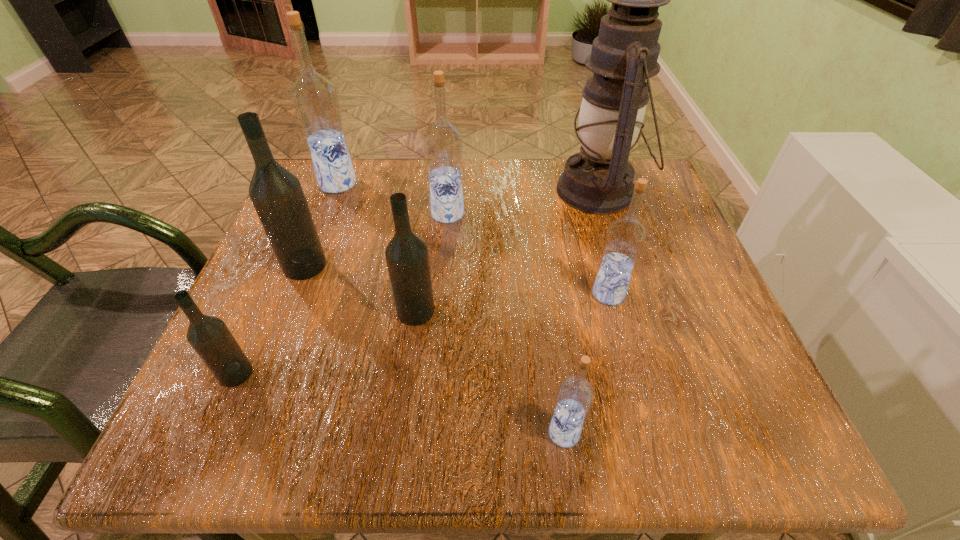
Find the location of a particular element. The image size is (960, 540). blue oil lamp is located at coordinates (599, 179).

Identify the location of the tallest vodka. The height and width of the screenshot is (540, 960). (315, 99).

At what (x,y) coordinates should I click in order to perform the action: click on the farthest vodka. Please return your answer as a coordinate pair (x, y). The height and width of the screenshot is (540, 960). Looking at the image, I should click on (315, 99).

The height and width of the screenshot is (540, 960). In order to click on the third smallest blue vodka in this screenshot , I will do `click(443, 141)`.

I want to click on the second farthest blue vodka, so click(443, 141).

Where is `the farthest black vodka`? This screenshot has width=960, height=540. the farthest black vodka is located at coordinates (277, 195).

The width and height of the screenshot is (960, 540). I want to click on the third farthest vodka, so click(x=277, y=195).

I want to click on the rightmost black vodka, so click(407, 258).

Identify the location of the second nearest black vodka. (407, 258).

Find the location of a particular element. This screenshot has height=540, width=960. the rightmost vodka is located at coordinates (626, 236).